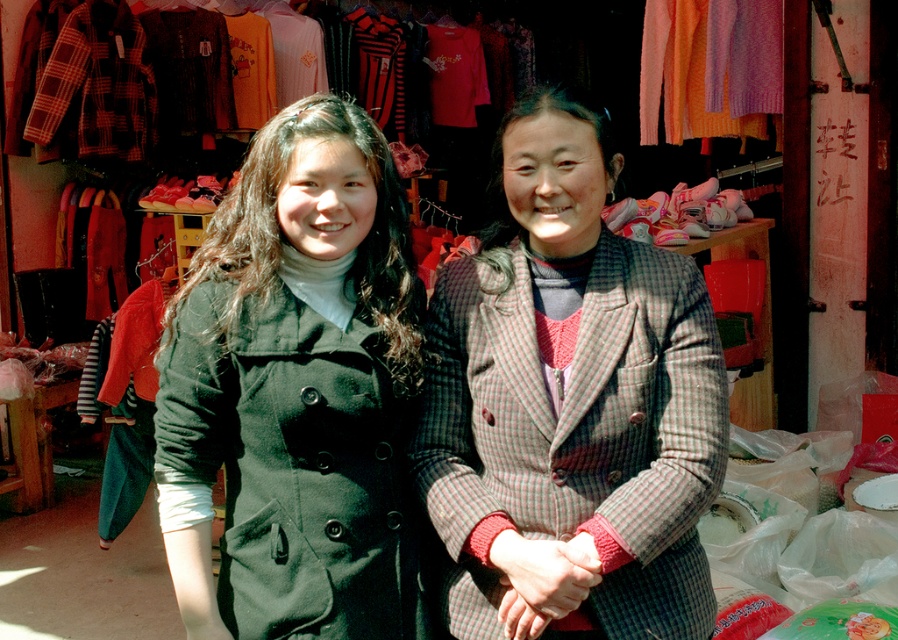
Question: From the image, what is the correct spatial relationship of matte black coat at left in relation to plaid woolen jacket at center?

Choices:
 (A) below
 (B) above

Answer: (B)

Question: Which object appears closest to the camera in this image?

Choices:
 (A) plaid woolen jacket at center
 (B) matte black coat at left

Answer: (A)

Question: Does matte black coat at left lie in front of plaid woolen jacket at center?

Choices:
 (A) yes
 (B) no

Answer: (B)

Question: Is matte black coat at left above plaid woolen jacket at center?

Choices:
 (A) yes
 (B) no

Answer: (A)

Question: Among these points, which one is nearest to the camera?

Choices:
 (A) (456, 548)
 (B) (401, 624)

Answer: (A)